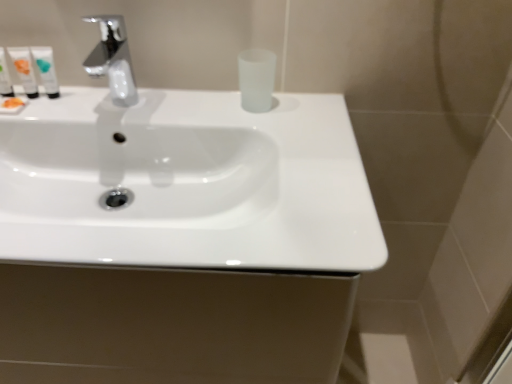
Identify the location of vacant space to the right of chrome metallic faucet at upper left. The width and height of the screenshot is (512, 384). (188, 124).